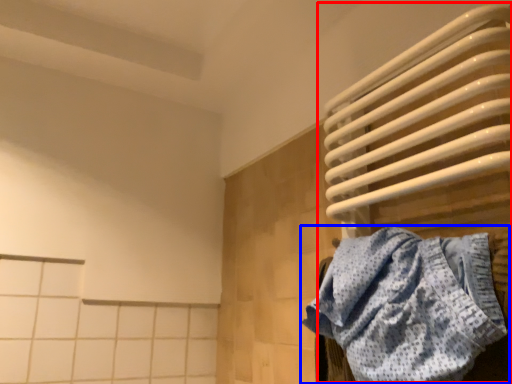
Question: Which point is further to the camera, water heater (highlighted by a red box) or towel (highlighted by a blue box)?

Choices:
 (A) water heater
 (B) towel

Answer: (A)